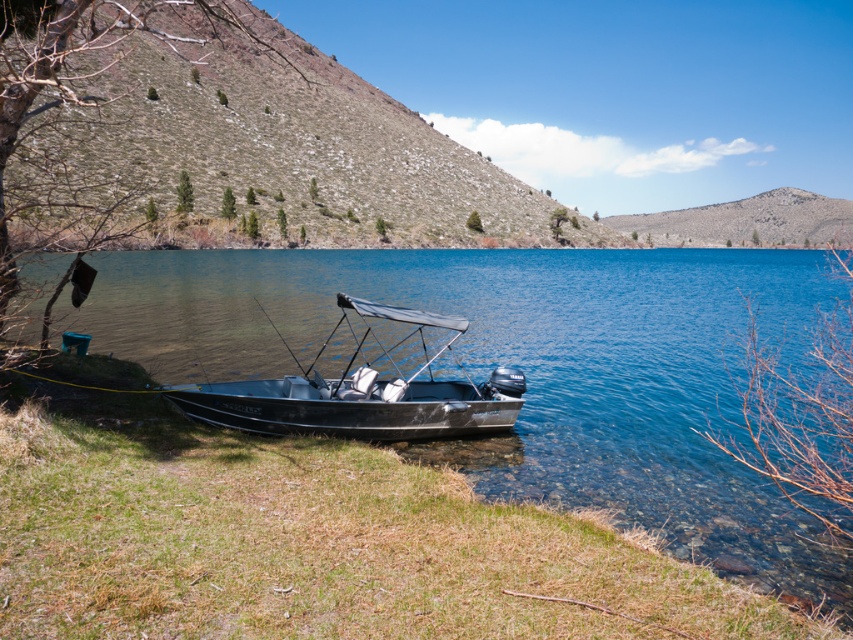
Measure the distance between point [355,436] and camera.

They are 38.95 feet apart.

Can you confirm if metallic gray boat at lower center is taller than dull gray rock at upper center?

No.

Does point (294, 410) lie behind point (706, 230)?

No, it is in front of (706, 230).

Locate an element on the screen. metallic gray boat at lower center is located at coordinates (363, 392).

Who is shorter, green grassy hillside at upper left or metallic gray boat at lower center?

Standing shorter between the two is metallic gray boat at lower center.

Does green grassy hillside at upper left come in front of metallic gray boat at lower center?

Yes, it is in front of metallic gray boat at lower center.

Between point (372, 177) and point (270, 403), which one is positioned behind?

Point (372, 177)

The height and width of the screenshot is (640, 853). I want to click on green grassy hillside at upper left, so [x=248, y=124].

Does green grassy hillside at upper left have a greater height compared to dull gray rock at upper center?

Correct, green grassy hillside at upper left is much taller as dull gray rock at upper center.

Which is more to the right, green grassy hillside at upper left or dull gray rock at upper center?

dull gray rock at upper center is more to the right.

Who is more forward, (112, 35) or (635, 228)?

Point (112, 35) is more forward.

What are the coordinates of `green grassy hillside at upper left` in the screenshot? It's located at (248, 124).